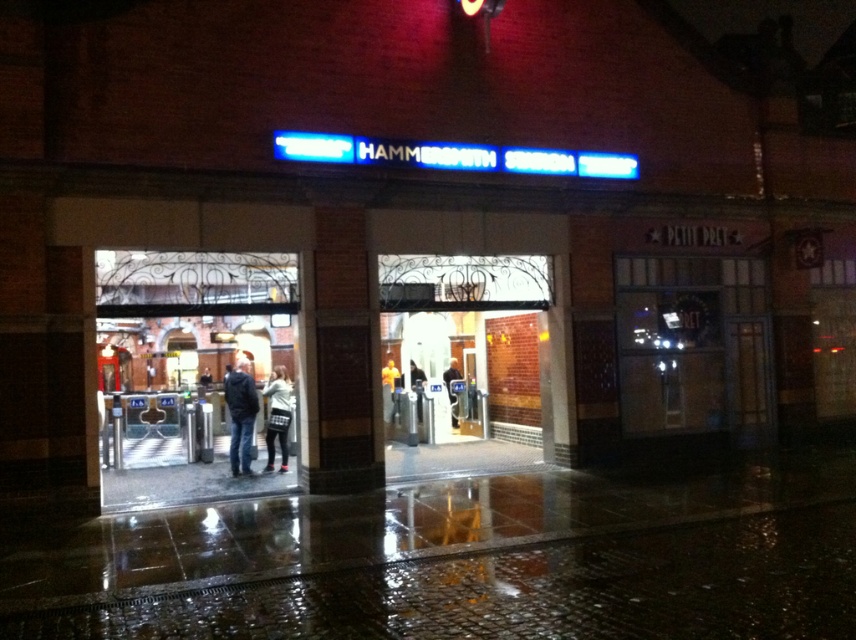
Question: Does brown brick pillar at center appear under dark blue jeans at center?

Choices:
 (A) yes
 (B) no

Answer: (B)

Question: Where is brown brick pillar at center located in relation to dark blue jacket at center in the image?

Choices:
 (A) below
 (B) above

Answer: (B)

Question: Which point is closer to the camera taking this photo?

Choices:
 (A) (330, 276)
 (B) (452, 406)

Answer: (A)

Question: Which of the following is the closest to the observer?

Choices:
 (A) (282, 442)
 (B) (235, 387)
 (C) (450, 392)

Answer: (B)

Question: Is white sweater at center wider than dark blue jeans at center?

Choices:
 (A) no
 (B) yes

Answer: (B)

Question: Which of these objects is positioned farthest from the dark blue jacket at center?

Choices:
 (A) dark blue jeans at center
 (B) brown brick pillar at center

Answer: (A)